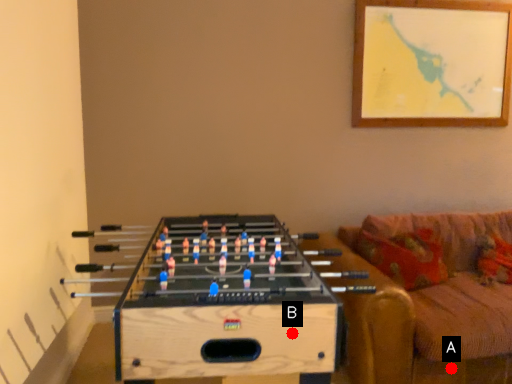
Question: Two points are circled on the image, labeled by A and B beside each circle. Which point appears closest to the camera in this image?

Choices:
 (A) A is closer
 (B) B is closer

Answer: (B)